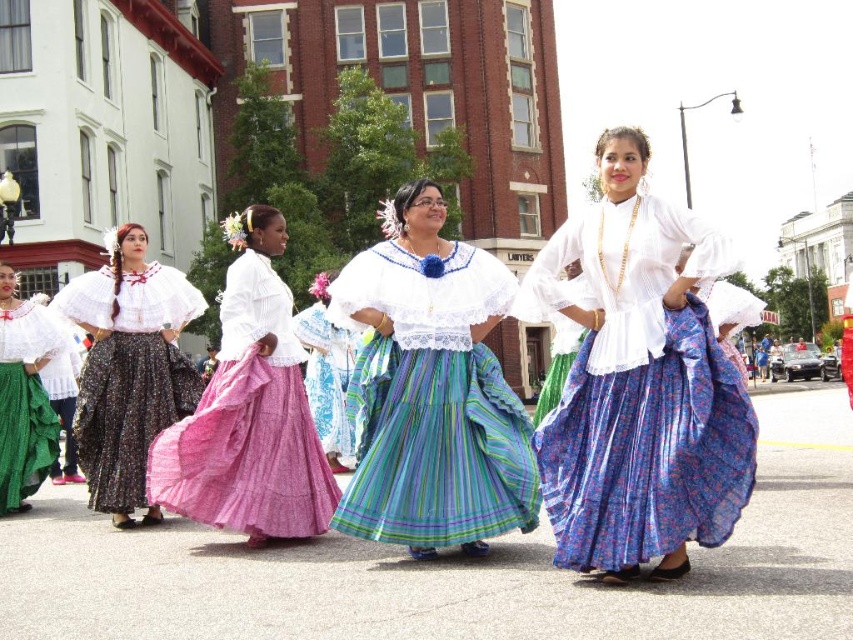
Is point (723, 476) positioned after point (503, 508)?

No, (723, 476) is closer to viewer.

Is textured cotton skirts at center bigger than striped cotton dress at center?

Correct, textured cotton skirts at center is larger in size than striped cotton dress at center.

You are a GUI agent. You are given a task and a screenshot of the screen. Output one action in this format:
    pyautogui.click(x=<x>, y=<y>)
    Task: Click on the textured cotton skirts at center
    Image resolution: width=853 pixels, height=640 pixels.
    Given the screenshot: What is the action you would take?
    pyautogui.click(x=637, y=381)

Between point (728, 500) and point (114, 304), which one is positioned behind?

Positioned behind is point (114, 304).

Can you confirm if textured cotton skirts at center is wider than matte black dress at left?

Yes.

Describe the element at coordinates (637, 381) in the screenshot. I see `textured cotton skirts at center` at that location.

The image size is (853, 640). I want to click on textured cotton skirts at center, so click(637, 381).

Is pink fabric skirt at center further to camera compared to striped cotton skirt at center?

No, it is not.

Which is in front, point (163, 456) or point (323, 310)?

Point (163, 456) is more forward.

I want to click on pink fabric skirt at center, so click(248, 412).